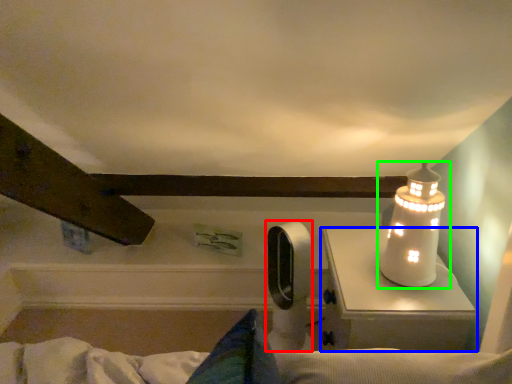
Question: Based on their relative distances, which object is farther from equipment (highlighted by a red box)? Choose from table (highlighted by a blue box) and lamp (highlighted by a green box).

Choices:
 (A) table
 (B) lamp

Answer: (B)